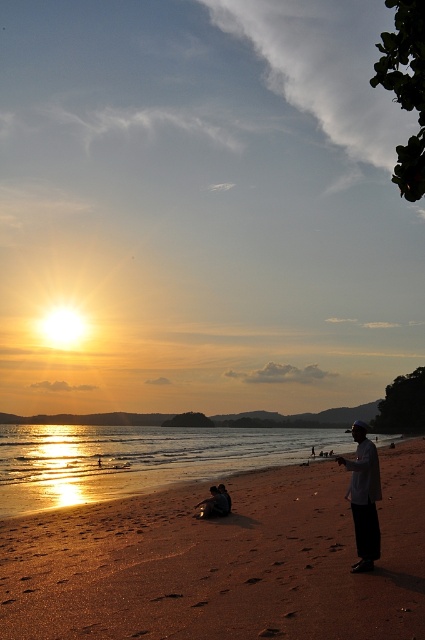
You are standing on the beach and see two points in the scene. The first point is at coordinate point (17, 541) and the second is at point (357, 474). Which point is closer to you?

Point (17, 541) is further to the viewer than point (357, 474), so the second point is closer to you.

You are planning to set up a small tent on the beach. The tent requires a minimum width of 2 meters to accommodate your gear. Given the brown sandy beach at lower center and the dark gray fabric at lower right, which location would be more suitable for setting up your tent?

The brown sandy beach at lower center might be wider than dark gray fabric at lower right, so it would be more suitable for setting up the tent as it likely meets the minimum width requirement of 2 meters.

You are standing on the brown sandy beach at lower center and want to place a small flag on the dark gray fabric at lower right. Considering the height difference between the two, will the flag be visible from your current position?

The brown sandy beach at lower center has a lesser height compared to dark gray fabric at lower right, so the flag placed on the dark gray fabric at lower right will be visible from your current position because it is elevated higher.